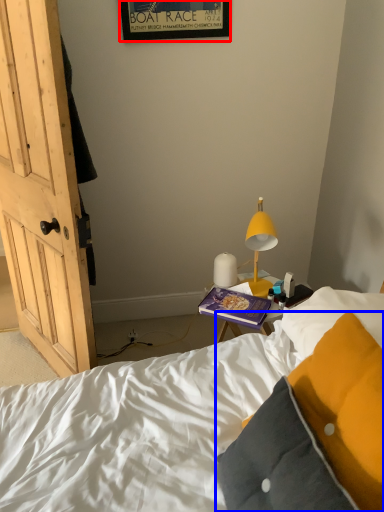
Question: Among these objects, which one is nearest to the camera, picture frame (highlighted by a red box) or pillow (highlighted by a blue box)?

Choices:
 (A) picture frame
 (B) pillow

Answer: (B)